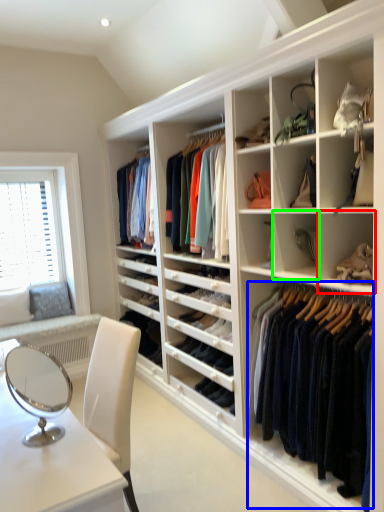
Question: Which object is positioned closest to shelf (highlighted by a red box)? Select from clothing (highlighted by a blue box) and shelf (highlighted by a green box).

Choices:
 (A) clothing
 (B) shelf

Answer: (B)